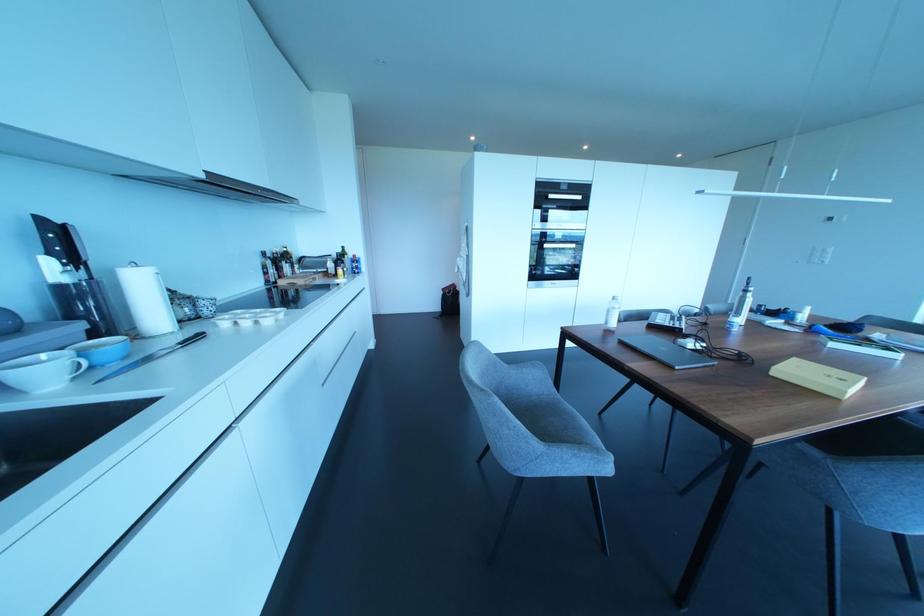
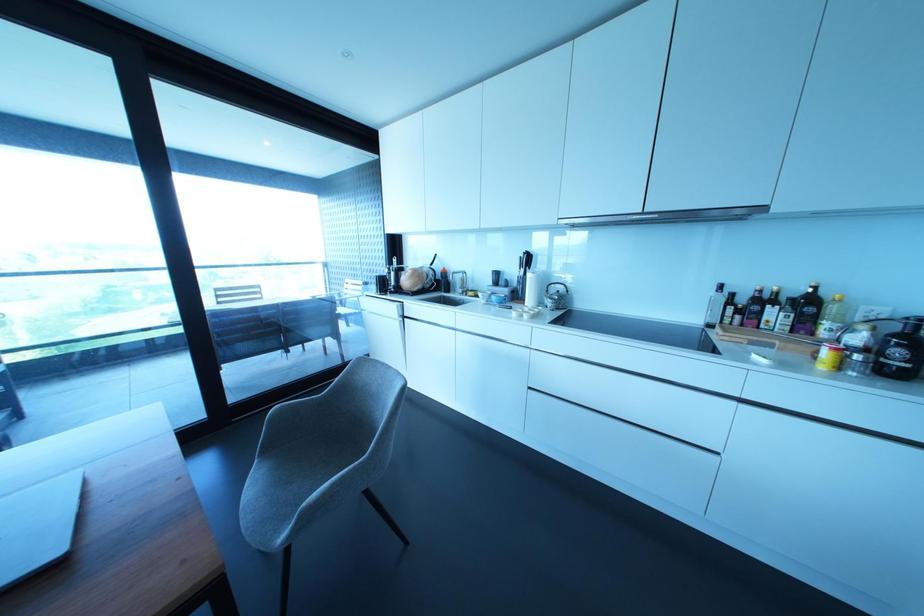
In the second image, find the point that corresponds to point 281,267 in the first image.

(760, 313)